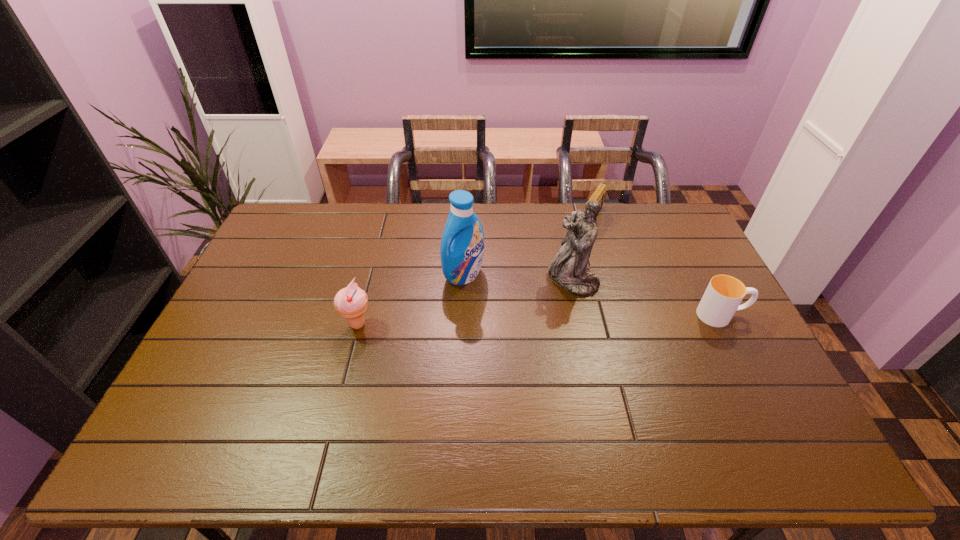
This screenshot has width=960, height=540. I want to click on the third shortest object, so click(x=351, y=302).

At what (x,y) coordinates should I click in order to perform the action: click on icecream. Please return your answer as a coordinate pair (x, y). The height and width of the screenshot is (540, 960). Looking at the image, I should click on (351, 302).

The image size is (960, 540). In order to click on cup in this screenshot , I will do `click(722, 298)`.

This screenshot has height=540, width=960. I want to click on figurine, so click(x=568, y=269).

Where is `the farthest object`? This screenshot has width=960, height=540. the farthest object is located at coordinates (598, 195).

Where is `detergent`? detergent is located at coordinates (462, 245).

This screenshot has width=960, height=540. Find the location of `blank space located 0.140m on the front of the third shortest object`. blank space located 0.140m on the front of the third shortest object is located at coordinates (344, 379).

Where is `free space located 0.150m on the front-facing side of the figurine`? free space located 0.150m on the front-facing side of the figurine is located at coordinates (519, 311).

Find the location of `vacant position located 0.130m on the front-facing side of the figurine`. vacant position located 0.130m on the front-facing side of the figurine is located at coordinates (525, 308).

This screenshot has width=960, height=540. Identify the location of vacant space located on the front-facing side of the figurine. (467, 343).